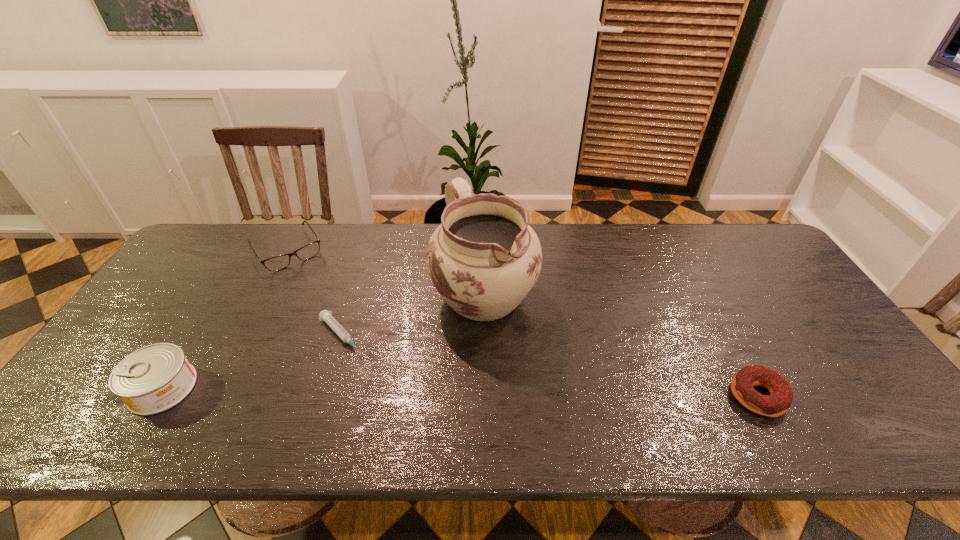
At what (x,y) coordinates should I click in order to perform the action: click on free area in between the tallest object and the spectacles. Please return your answer as a coordinate pair (x, y). This screenshot has height=540, width=960. Looking at the image, I should click on (386, 271).

Find the location of `empty location between the can and the rightmost object`. empty location between the can and the rightmost object is located at coordinates (460, 392).

The image size is (960, 540). In order to click on unoccupied position between the pitcher and the fourth shortest object in this screenshot , I will do `click(324, 340)`.

The height and width of the screenshot is (540, 960). What are the coordinates of `unoccupied position between the doughnut and the can` in the screenshot? It's located at (460, 392).

The width and height of the screenshot is (960, 540). Identify the location of free space between the spectacles and the can. (225, 319).

The image size is (960, 540). Find the location of `free point between the second object from right to left and the third object from left to right`. free point between the second object from right to left and the third object from left to right is located at coordinates (413, 314).

I want to click on empty space between the doughnut and the pitcher, so click(621, 345).

You are a GUI agent. You are given a task and a screenshot of the screen. Output one action in this format:
    pyautogui.click(x=<x>, y=<y>)
    Task: Click on the vacant space in between the can and the doughnut
    
    Given the screenshot: What is the action you would take?
    pyautogui.click(x=460, y=392)

Image resolution: width=960 pixels, height=540 pixels. What are the coordinates of `vacant region between the second object from right to left and the syringe` in the screenshot? It's located at (413, 314).

Where is `vacant area that lies between the shortest object and the spectacles`? This screenshot has height=540, width=960. vacant area that lies between the shortest object and the spectacles is located at coordinates (314, 293).